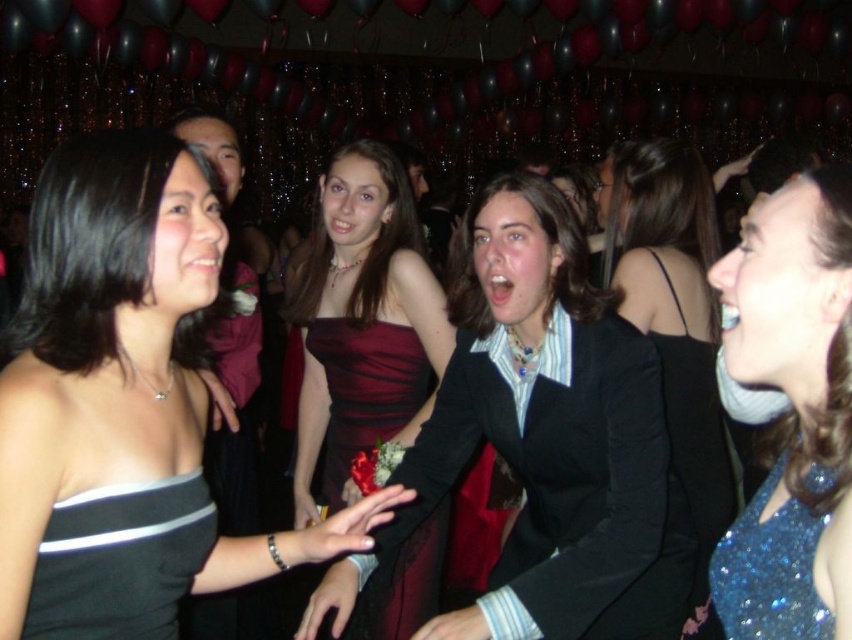
Question: Is black satin dress at upper left behind sparkly blue dress at upper right?

Choices:
 (A) yes
 (B) no

Answer: (A)

Question: Where is sparkly blue dress at upper right located in relation to black satin dress at left in the image?

Choices:
 (A) below
 (B) above

Answer: (B)

Question: Which point is closer to the camera taking this photo?

Choices:
 (A) (695, 291)
 (B) (525, 248)
 (C) (27, 381)

Answer: (C)

Question: Does shiny burgundy dress at center appear under black satin dress at left?

Choices:
 (A) no
 (B) yes

Answer: (A)

Question: Which point appears farthest from the camera in this image?

Choices:
 (A) (375, 579)
 (B) (315, 552)
 (C) (776, 513)
 (D) (504, 221)

Answer: (A)

Question: Estimate the real-world distances between objects in this image. Which object is closer to the black satin dress at left?

Choices:
 (A) burgundy satin dress at center
 (B) black satin dress at upper left
 (C) sparkly blue dress at upper right
 (D) shiny burgundy dress at center

Answer: (B)